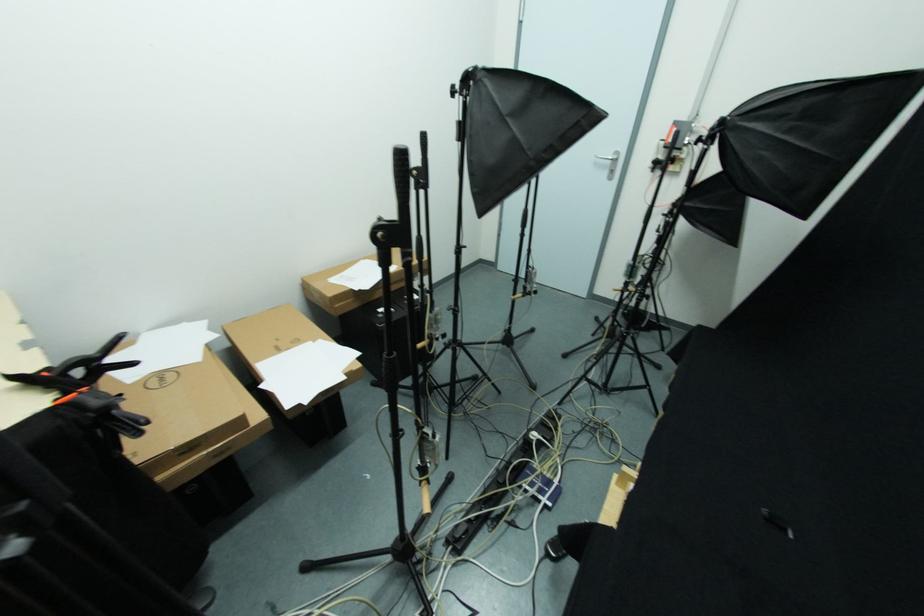
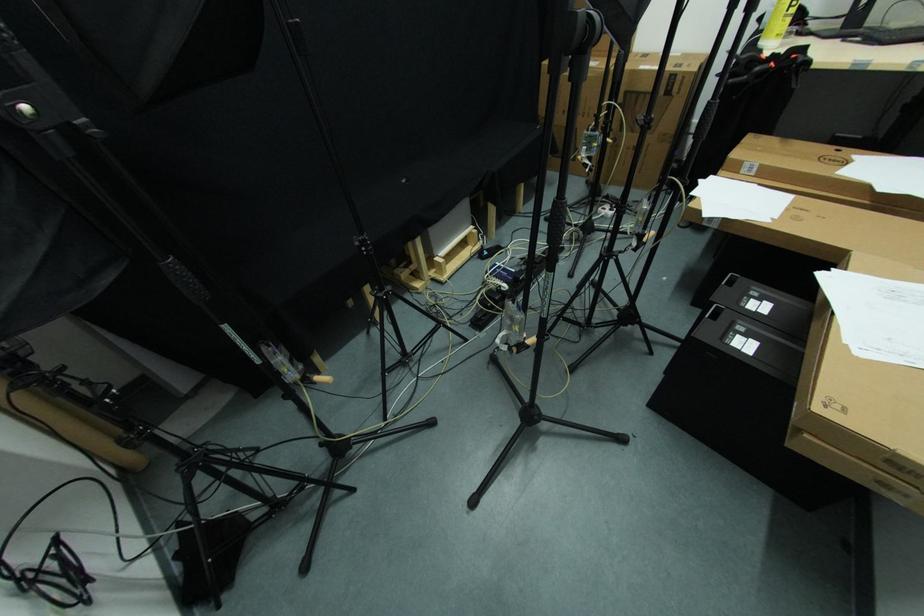
Where in the second image is the point corresponding to [503,438] from the first image?

(535, 310)